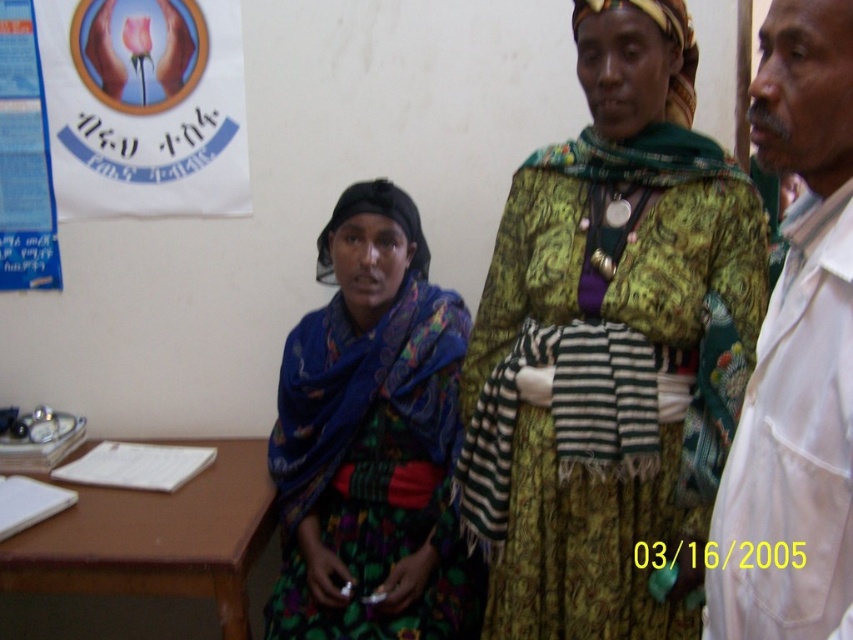
Question: Does green textured dress at center come in front of blue paper at left?

Choices:
 (A) no
 (B) yes

Answer: (B)

Question: Is green textured dress at center closer to the viewer compared to blue paper at left?

Choices:
 (A) yes
 (B) no

Answer: (A)

Question: Which point is farther to the camera?

Choices:
 (A) printed fabric dress at center
 (B) white paper poster at upper left

Answer: (B)

Question: Which object appears closest to the camera in this image?

Choices:
 (A) blue paper at left
 (B) white paper poster at upper left
 (C) white smooth lab coat at right
 (D) printed fabric dress at center

Answer: (C)

Question: Which point is farther from the camera taking this photo?

Choices:
 (A) (635, 60)
 (B) (41, 195)
 (C) (374, 637)
 (D) (231, 572)

Answer: (B)

Question: In this image, where is green textured dress at center located relative to blue paper at left?

Choices:
 (A) below
 (B) above

Answer: (A)